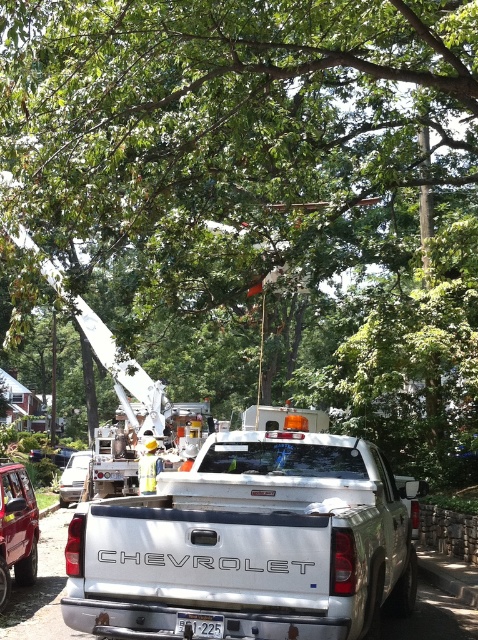
Question: Which of the following is the farthest from the observer?

Choices:
 (A) (265, 461)
 (B) (63, 488)
 (C) (204, 634)

Answer: (B)

Question: Considering the relative positions of white metallic truck at center and metallic silver van at center in the image provided, where is white metallic truck at center located with respect to metallic silver van at center?

Choices:
 (A) above
 (B) below

Answer: (A)

Question: Among these objects, which one is farthest from the camera?

Choices:
 (A) metallic silver van at center
 (B) white plastic license plate at center

Answer: (A)

Question: Is metallic silver van at center wider than white plastic license plate at center?

Choices:
 (A) no
 (B) yes

Answer: (B)

Question: Which of the following is the closest to the observer?

Choices:
 (A) (75, 500)
 (B) (193, 630)
 (C) (126, 515)

Answer: (B)

Question: Is metallic silver van at center closer to the viewer compared to white plastic license plate at center?

Choices:
 (A) yes
 (B) no

Answer: (B)